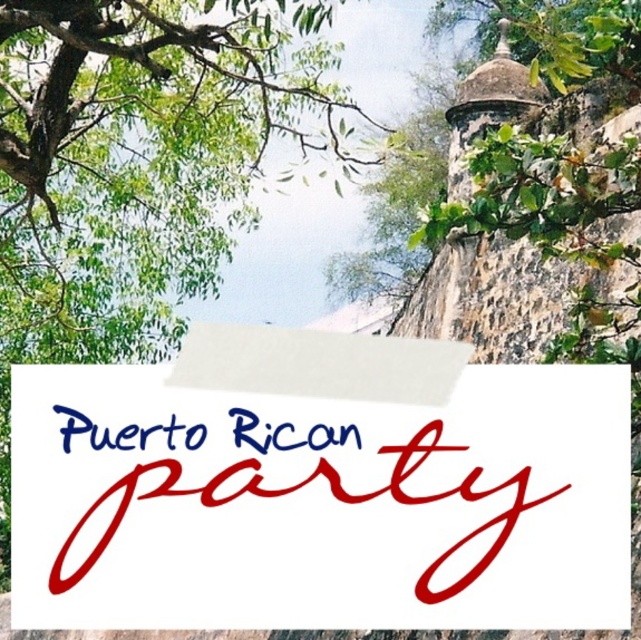
Question: Is white paper sign at center above blue ink text at center?

Choices:
 (A) yes
 (B) no

Answer: (B)

Question: Considering the relative positions of green leafy tree at upper left and blue ink text at center in the image provided, where is green leafy tree at upper left located with respect to blue ink text at center?

Choices:
 (A) above
 (B) below

Answer: (A)

Question: Which object is closer to the camera taking this photo?

Choices:
 (A) white paper sign at center
 (B) green leafy tree at upper left
 (C) blue ink text at center

Answer: (A)

Question: Does white paper sign at center have a lesser width compared to blue ink text at center?

Choices:
 (A) yes
 (B) no

Answer: (B)

Question: Which object appears farthest from the camera in this image?

Choices:
 (A) blue ink text at center
 (B) green leafy tree at upper left

Answer: (B)

Question: Among these objects, which one is nearest to the camera?

Choices:
 (A) white paper sign at center
 (B) blue ink text at center
 (C) green leafy tree at upper left

Answer: (A)